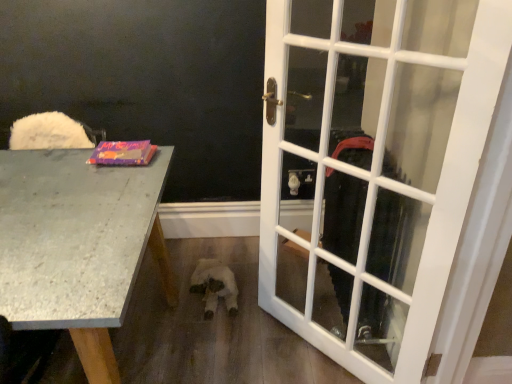
What are the coordinates of `vacant area situated below white plush toy at center (from a real-world perspective)` in the screenshot? It's located at (210, 268).